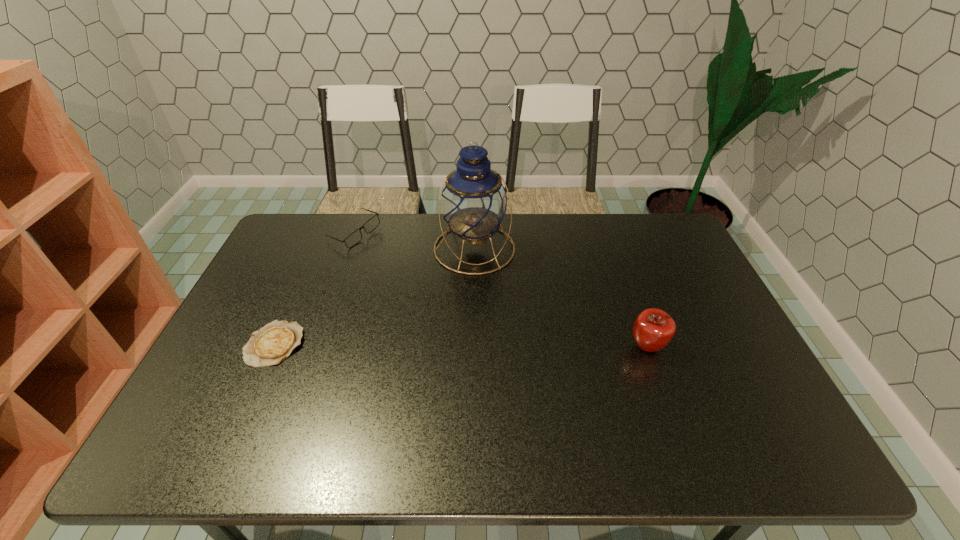
Identify the location of free space between the apple and the shortest object. This screenshot has height=540, width=960. (461, 346).

At what (x,y) coordinates should I click in order to perform the action: click on vacant area between the spectacles and the quiche. Please return your answer as a coordinate pair (x, y). The image size is (960, 540). Looking at the image, I should click on (315, 289).

The width and height of the screenshot is (960, 540). In order to click on free space between the apple and the second shortest object in this screenshot , I will do `click(500, 290)`.

Where is `the closest object relative to the spectacles`? This screenshot has width=960, height=540. the closest object relative to the spectacles is located at coordinates (474, 201).

Identify which object is the third closest to the apple. Please provide its 2D coordinates. Your answer should be formatted as a tuple, i.e. [(x, y)], where the tuple contains the x and y coordinates of a point satisfying the conditions above.

[(270, 345)]

The image size is (960, 540). In order to click on vacant area that satisfies the following two spatial constraints: 1. on the front side of the apple; 2. on the left side of the quiche in this screenshot , I will do `click(274, 347)`.

At what (x,y) coordinates should I click in order to perform the action: click on free location that satisfies the following two spatial constraints: 1. on the front side of the rightmost object; 2. on the right side of the second object from right to left. Please return your answer as a coordinate pair (x, y). The height and width of the screenshot is (540, 960). Looking at the image, I should click on (473, 347).

Where is `vacant space that satisfies the following two spatial constraints: 1. on the front side of the shortest object; 2. on the right side of the second tallest object`? The height and width of the screenshot is (540, 960). vacant space that satisfies the following two spatial constraints: 1. on the front side of the shortest object; 2. on the right side of the second tallest object is located at coordinates (274, 347).